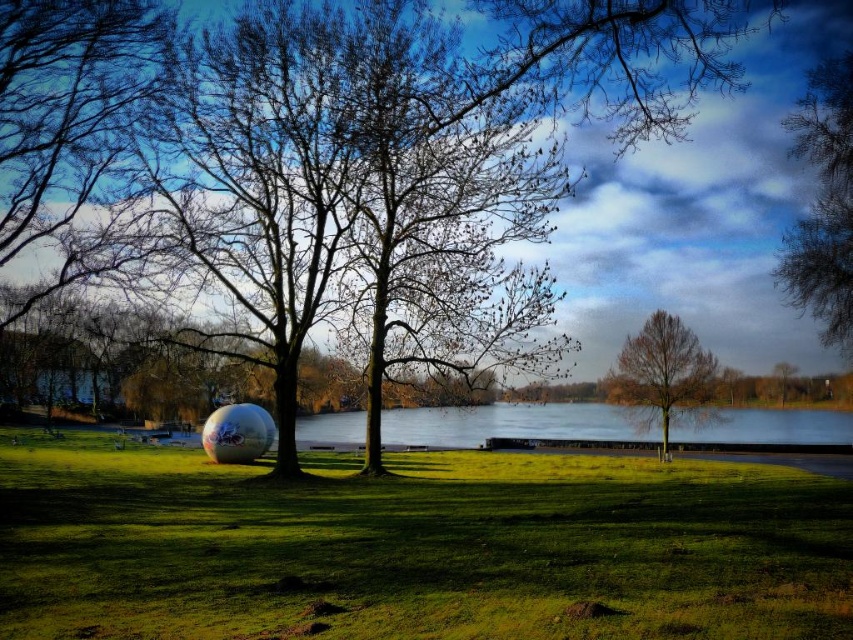
Which is below, brown matte tree at center or glossy metallic beach ball at lower left?

Positioned lower is glossy metallic beach ball at lower left.

In the scene shown: Between brown matte tree at center and glossy metallic beach ball at lower left, which one appears on the right side from the viewer's perspective?

From the viewer's perspective, brown matte tree at center appears more on the right side.

You are a GUI agent. You are given a task and a screenshot of the screen. Output one action in this format:
    pyautogui.click(x=<x>, y=<y>)
    Task: Click on the brown matte tree at center
    The image size is (853, 640).
    Given the screenshot: What is the action you would take?
    pyautogui.click(x=664, y=376)

The image size is (853, 640). I want to click on brown matte tree at center, so click(x=664, y=376).

Describe the element at coordinates (822, 204) in the screenshot. I see `bare branches at upper right` at that location.

Can you confirm if bare branches at upper right is smaller than brown matte tree at center?

Actually, bare branches at upper right might be larger than brown matte tree at center.

Where is `bare branches at upper right`? bare branches at upper right is located at coordinates (822, 204).

Is green grassy at center to the right of glossy metallic beach ball at lower left from the viewer's perspective?

Yes, green grassy at center is to the right of glossy metallic beach ball at lower left.

What do you see at coordinates (415, 547) in the screenshot? The width and height of the screenshot is (853, 640). I see `green grassy at center` at bounding box center [415, 547].

Locate an element on the screen. green grassy at center is located at coordinates (415, 547).

The image size is (853, 640). I want to click on green grassy at center, so click(x=415, y=547).